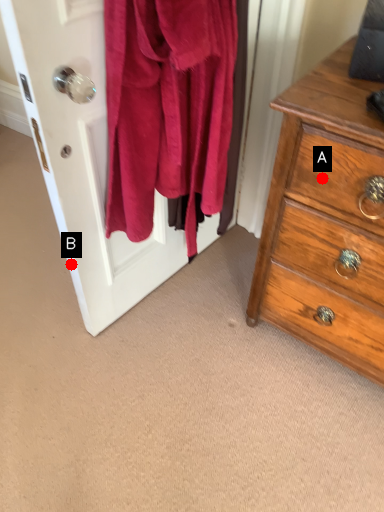
Question: Two points are circled on the image, labeled by A and B beside each circle. Which point is farther to the camera?

Choices:
 (A) A is further
 (B) B is further

Answer: (B)